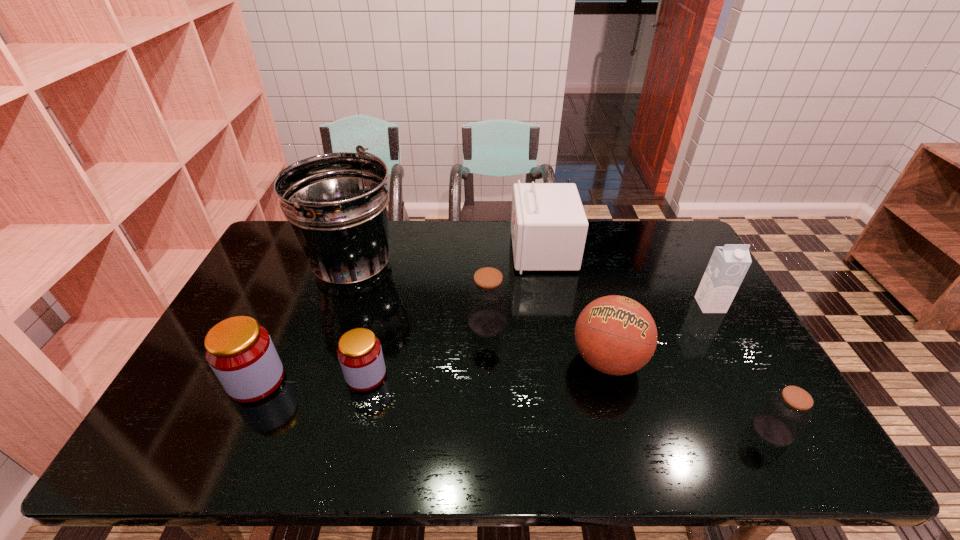
What are the coordinates of `vacant space at the near edge` in the screenshot? It's located at (252, 450).

In the image, there is a desktop. Where is `vacant space at the left edge`? vacant space at the left edge is located at coordinates (263, 305).

Identify the location of free space at the right edge of the desktop. (664, 266).

Where is `free space between the smaller red jar and the second jar from right to left`? This screenshot has width=960, height=540. free space between the smaller red jar and the second jar from right to left is located at coordinates (427, 349).

Where is `free point between the fifth object from right to left and the nearest jar`? The width and height of the screenshot is (960, 540). free point between the fifth object from right to left and the nearest jar is located at coordinates [630, 376].

Find the location of a particular element. This screenshot has width=960, height=540. empty space between the basketball and the smaller red jar is located at coordinates (487, 368).

What are the coordinates of `free space between the bucket and the nearer brown jar` in the screenshot? It's located at (563, 349).

The width and height of the screenshot is (960, 540). I want to click on free space between the smaller red jar and the right brown jar, so click(x=569, y=403).

This screenshot has width=960, height=540. In order to click on free space between the leftmost jar and the smaller red jar in this screenshot , I will do `click(311, 377)`.

Identify the location of vacant space that's between the leftmost jar and the smaller red jar. (311, 377).